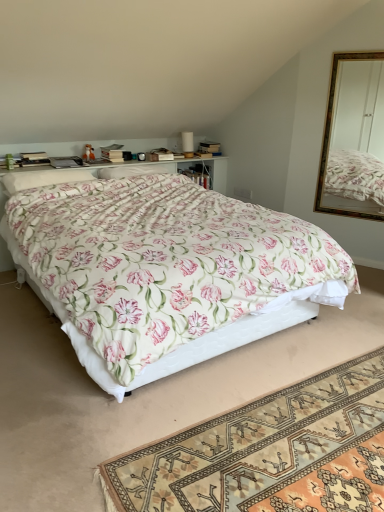
Question: From the image's perspective, is floral fabric pillow at center, which ranks as the 2th pillow in left-to-right order, above or below floral fabric rug at lower center?

Choices:
 (A) below
 (B) above

Answer: (B)

Question: Does point (139, 167) appear closer or farther from the camera than point (273, 471)?

Choices:
 (A) closer
 (B) farther

Answer: (B)

Question: Which of these objects is positioned farthest from the matte brown box at upper center?

Choices:
 (A) white soft pillow at upper left, which is the 2th pillow in back-to-front order
 (B) floral fabric rug at lower center
 (C) floral fabric pillow at center, the first pillow viewed from the right
 (D) floral fabric bed at center
 (E) hardcover book at upper left

Answer: (B)

Question: Estimate the real-world distances between objects in this image. Which object is closer to the floral fabric bed at center?

Choices:
 (A) white soft pillow at upper left, placed as the second pillow when sorted from right to left
 (B) floral fabric pillow at center, which ranks as the 2th pillow in left-to-right order
 (C) gold-framed mirror at upper right
 (D) floral fabric rug at lower center
 (E) matte brown box at upper center

Answer: (D)